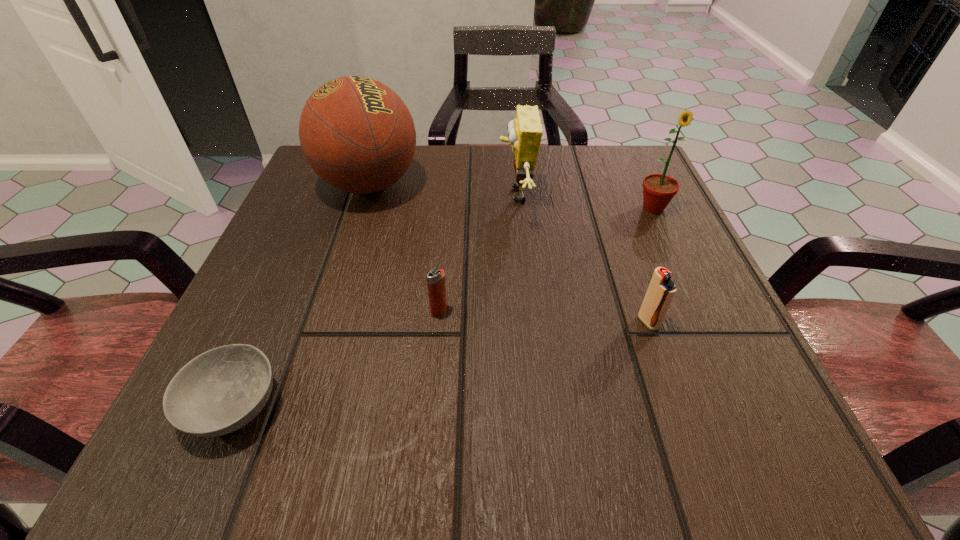
Where is `basketball`? basketball is located at coordinates (356, 133).

What are the coordinates of `the rightmost object` in the screenshot? It's located at (658, 189).

Where is `the third tallest object`? the third tallest object is located at coordinates (525, 132).

The image size is (960, 540). Find the location of `the third object from right to left`. the third object from right to left is located at coordinates (525, 132).

Where is `the fourth tallest object`? the fourth tallest object is located at coordinates (661, 290).

This screenshot has height=540, width=960. Identify the location of the fifth object from left to right. (661, 290).

The height and width of the screenshot is (540, 960). In order to click on the left igniter in this screenshot , I will do `click(436, 286)`.

What are the coordinates of `the shorter igniter` in the screenshot? It's located at (436, 286).

The height and width of the screenshot is (540, 960). In order to click on the nearest object in this screenshot , I will do tap(221, 390).

Where is `bowl`? Image resolution: width=960 pixels, height=540 pixels. bowl is located at coordinates (221, 390).